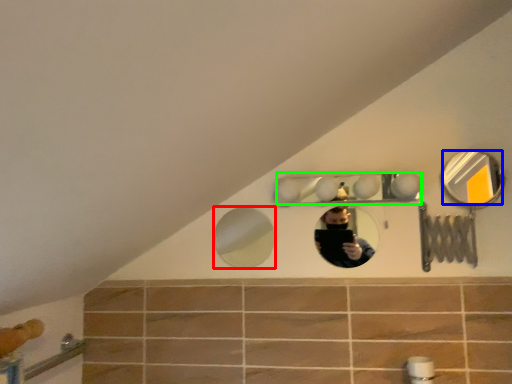
Question: Estimate the real-world distances between objects in this image. Which object is closer to mirror (highlighted by a red box), mirror (highlighted by a blue box) or mirror (highlighted by a green box)?

Choices:
 (A) mirror
 (B) mirror

Answer: (A)